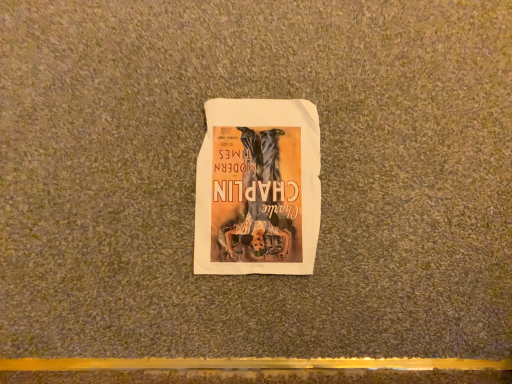
Describe the element at coordinates (258, 188) in the screenshot. I see `matte paper poster at center` at that location.

This screenshot has width=512, height=384. I want to click on matte paper poster at center, so click(x=258, y=188).

You are a GUI agent. You are given a task and a screenshot of the screen. Output one action in this format:
    pyautogui.click(x=<x>, y=<y>)
    Task: Click on the matte paper poster at center
    The image size is (512, 384).
    Given the screenshot: What is the action you would take?
    pyautogui.click(x=258, y=188)